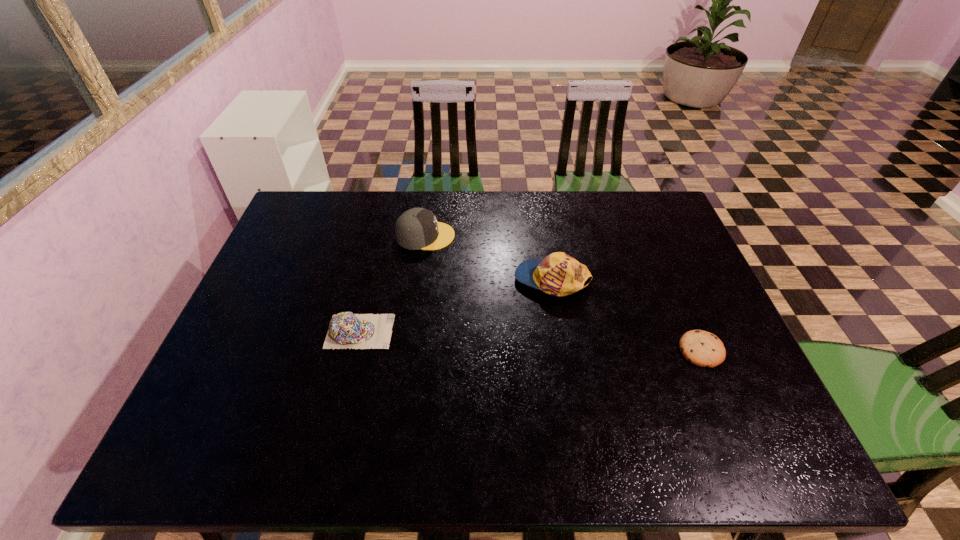
What are the coordinates of `vacant area situated 0.080m on the front-facing side of the farthest cap` in the screenshot? It's located at (480, 236).

The width and height of the screenshot is (960, 540). I want to click on vacant region located on the front, side, and top of the shortest cap, so click(451, 332).

I want to click on free space located on the left of the cookie, so (x=577, y=350).

Identify the location of object that is at the far edge. The image size is (960, 540). (417, 228).

Locate an element on the screen. object at the right edge is located at coordinates (701, 348).

Where is `free space at the far edge of the desktop`? free space at the far edge of the desktop is located at coordinates [x=378, y=208].

The image size is (960, 540). I want to click on vacant point at the near edge, so click(x=597, y=439).

Find the location of a particular element. The height and width of the screenshot is (540, 960). vacant region at the left edge of the desktop is located at coordinates (247, 323).

At what (x,y) coordinates should I click in order to perform the action: click on free region at the right edge. Please return your answer as a coordinate pair (x, y). The width and height of the screenshot is (960, 540). Looking at the image, I should click on (735, 390).

The image size is (960, 540). Find the location of `vacant space at the far left corner`. vacant space at the far left corner is located at coordinates (297, 219).